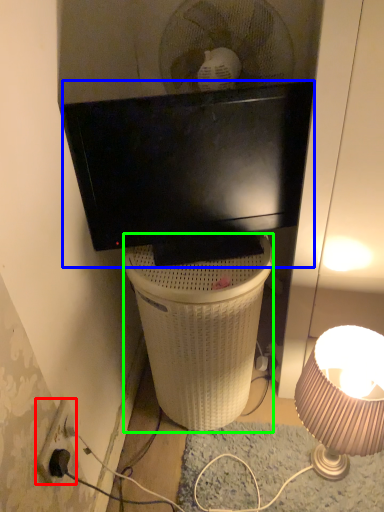
Question: Which is nearer to the power outlet (highlighted by a red box)? television (highlighted by a blue box) or trash bin/can (highlighted by a green box).

Choices:
 (A) television
 (B) trash bin/can

Answer: (B)